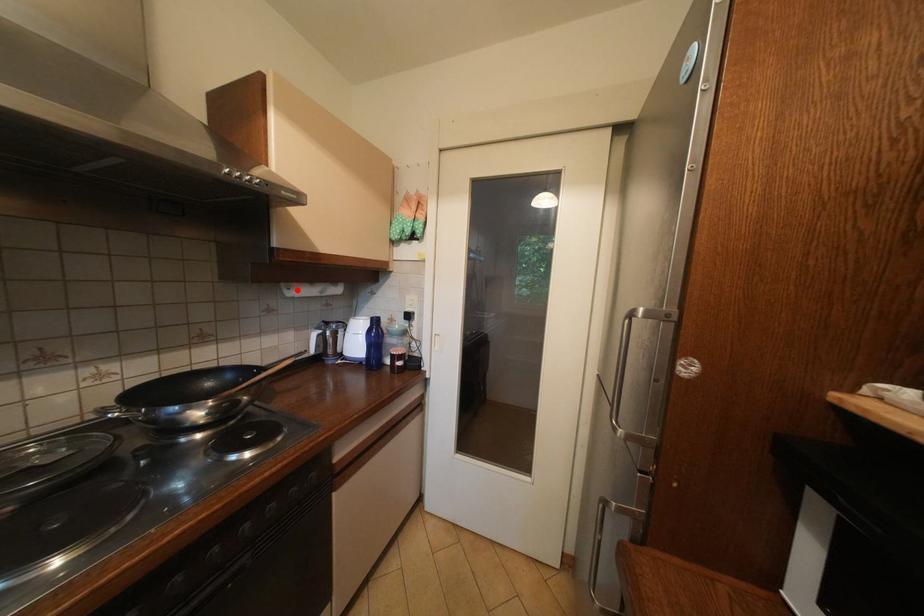
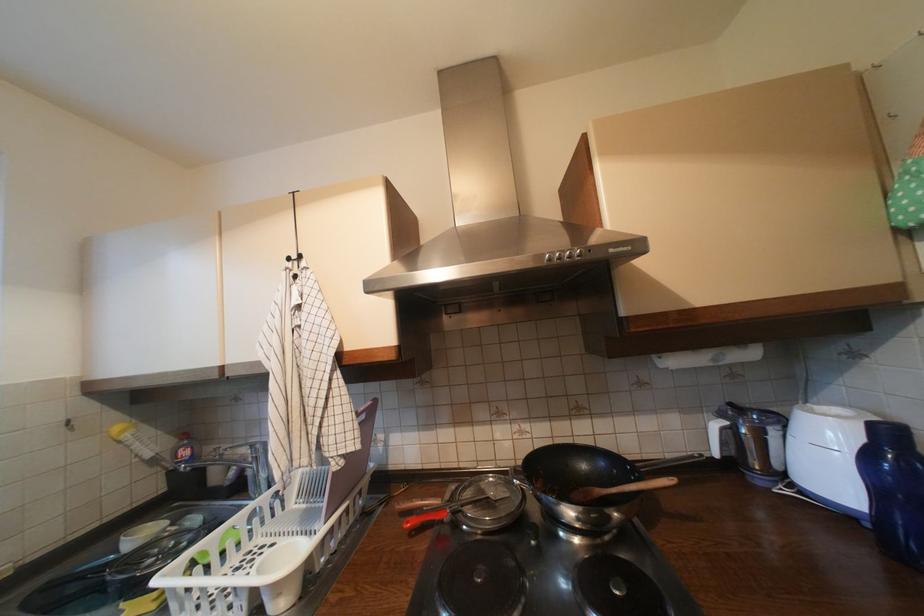
Where in the second image is the point corresponding to the highlighted location from the first image?

(669, 359)